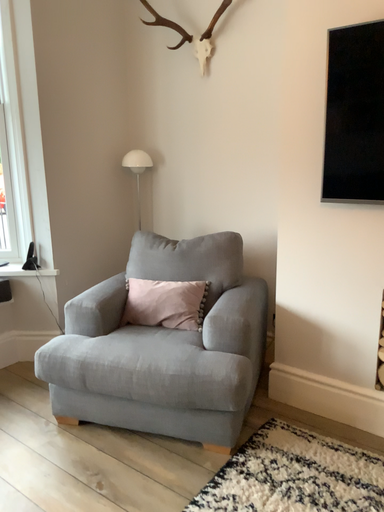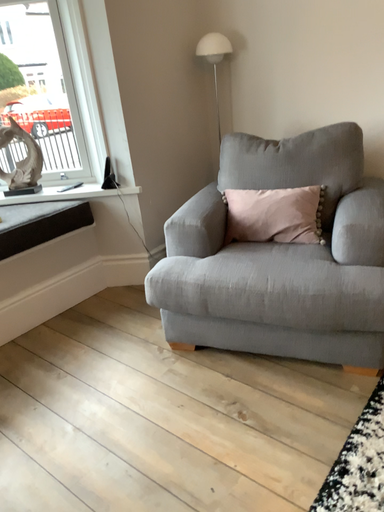
Question: How did the camera likely rotate when shooting the video?

Choices:
 (A) rotated downward
 (B) rotated upward

Answer: (A)